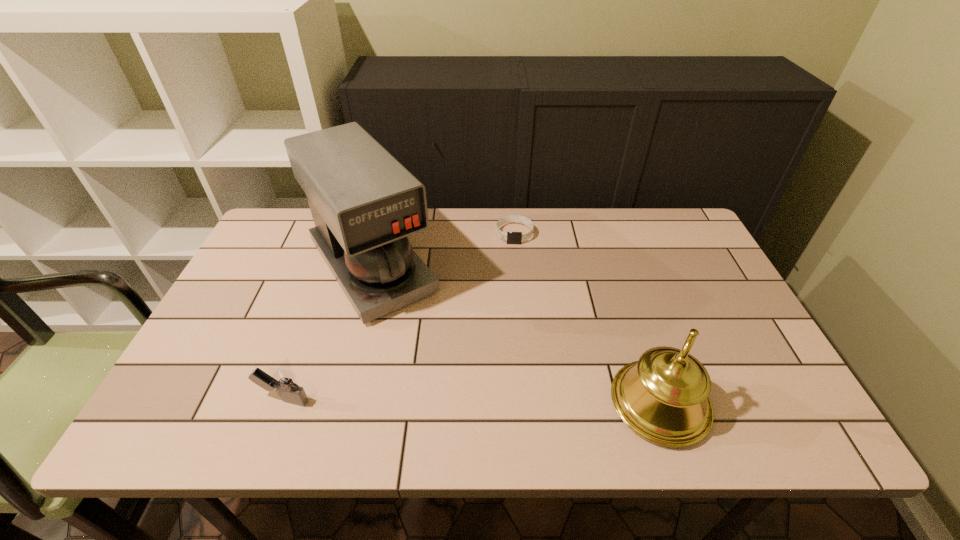
Find the location of a particular element. The height and width of the screenshot is (540, 960). blank space located 0.280m on the carafe side of the tallest object is located at coordinates click(459, 397).

The width and height of the screenshot is (960, 540). What are the coordinates of `vacant space located 0.320m on the outer surface of the wristband` in the screenshot? It's located at (515, 325).

Locate an element on the screen. Image resolution: width=960 pixels, height=540 pixels. free region located on the outer surface of the wristband is located at coordinates (515, 343).

This screenshot has width=960, height=540. Find the location of `free space located on the outer surface of the wristband`. free space located on the outer surface of the wristband is located at coordinates (515, 264).

In order to click on coffee maker present at the far edge in this screenshot , I will do `click(364, 203)`.

At what (x,y) coordinates should I click in order to perform the action: click on wristband that is at the far edge. Please return your answer as a coordinate pair (x, y). Image resolution: width=960 pixels, height=540 pixels. Looking at the image, I should click on (511, 237).

Image resolution: width=960 pixels, height=540 pixels. What are the coordinates of `igniter positioned at the near edge` in the screenshot? It's located at (283, 380).

What are the coordinates of `bell that is at the near edge` in the screenshot? It's located at (663, 397).

The width and height of the screenshot is (960, 540). Identify the location of object positioned at the left edge. (364, 203).

Where is `object present at the far left corner`? This screenshot has width=960, height=540. object present at the far left corner is located at coordinates (364, 203).